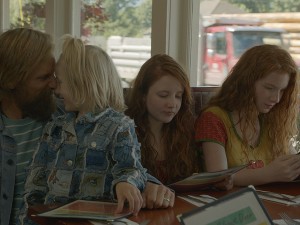
The width and height of the screenshot is (300, 225). I want to click on brown table, so click(173, 206).